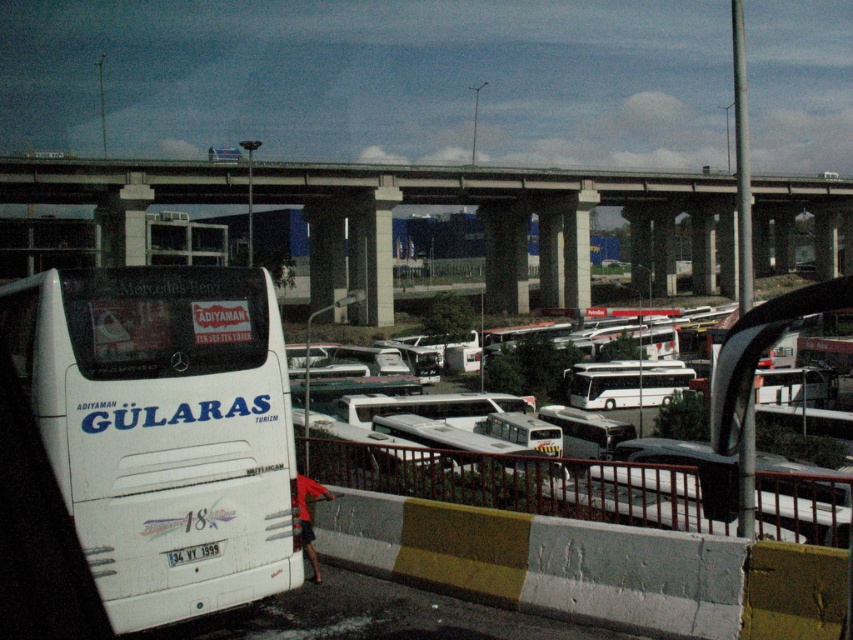
You are a photographer standing at the bus terminal. You see the concrete at center and the white plastic license plate at lower center. Which object is taller?

The concrete at center is taller than the white plastic license plate at lower center.

You are a delivery person who needs to park a truck that is 2 meters wide. You see the white matte bus at left and the concrete at center. Which area can accommodate your truck?

The concrete at center has a greater width than the white matte bus at left, so the truck can be parked on the concrete at center since it is wider than the truck.

You are standing at the point with coordinates point (364, 308) and want to walk towards the bus. Is the point point (273, 564) blocking your path?

Point (273, 564) is in front of point (364, 308), so yes, the point point (273, 564) is blocking your path.